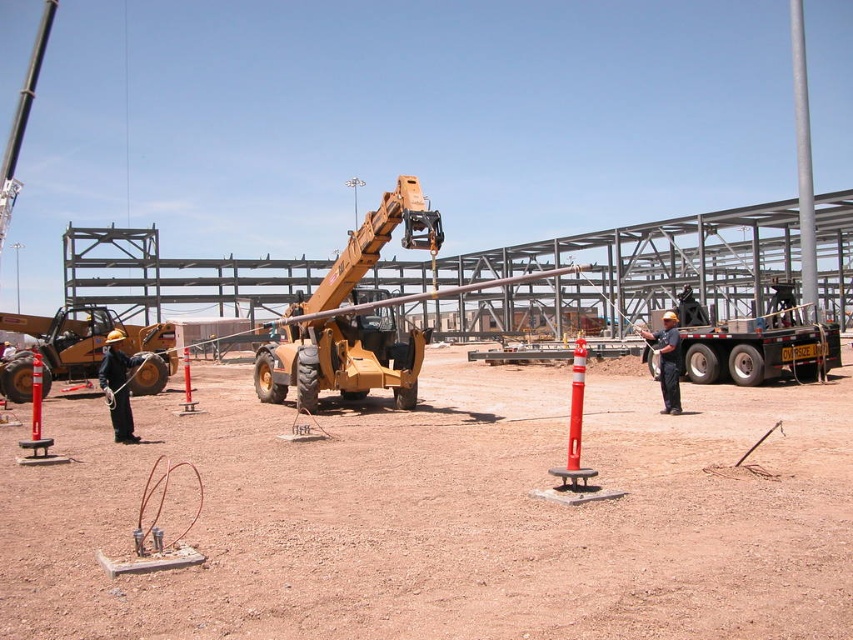
Question: Which point appears closest to the camera in this image?

Choices:
 (A) (706, 349)
 (B) (123, 406)

Answer: (B)

Question: Does metallic trailer truck at center have a greater width compared to dark blue uniform at center?

Choices:
 (A) yes
 (B) no

Answer: (B)

Question: Does metallic trailer truck at center appear over silver metallic pole at upper right?

Choices:
 (A) yes
 (B) no

Answer: (B)

Question: Which point appears closest to the camera in this image?

Choices:
 (A) (123, 364)
 (B) (286, 328)
 (C) (811, 200)
 (D) (502, 605)

Answer: (D)

Question: Which point is farther to the camera?

Choices:
 (A) (674, 348)
 (B) (109, 330)

Answer: (B)

Question: Does matte yellow telescopic handler at center appear on the left side of metallic trailer truck at center?

Choices:
 (A) no
 (B) yes

Answer: (B)